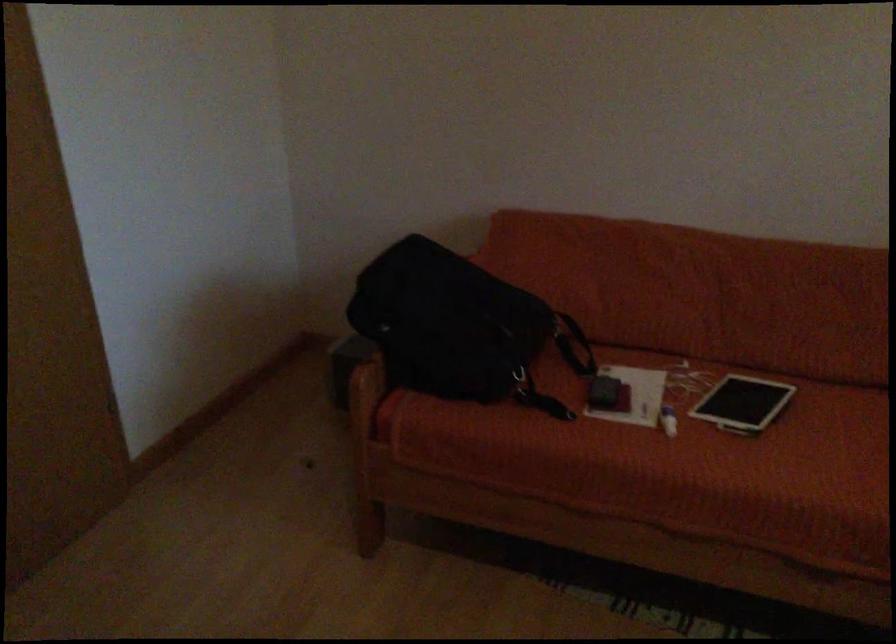
Find where to pull the bag strap. Please return your answer as a coordinate pair (x, y).

(567, 332)